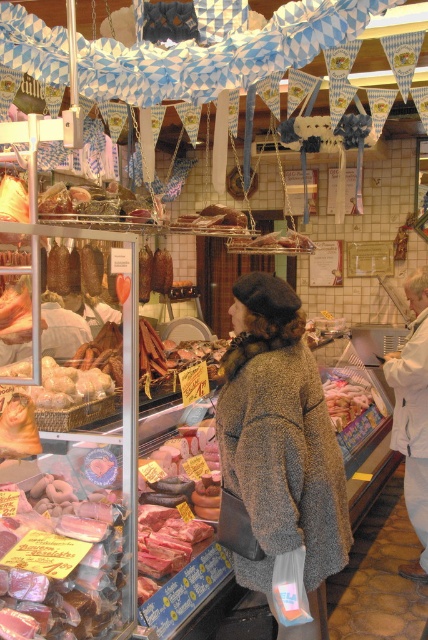
You are a customer in the butcher shop and want to know which item is taller between the pink glossy meat at lower left and the smooth pink sausage at center. Can you tell me?

The pink glossy meat at lower left is taller than the smooth pink sausage at center.

You are a customer in the butcher shop and want to know if your fuzzy brown coat at center will fit in the same shopping bag as the pink glossy meat at lower left. The bag can only hold items where the larger item is no more than twice the size of the smaller one. Can both items fit together?

The fuzzy brown coat at center is bigger than the pink glossy meat at lower left. Since the bag requires the larger item to be no more than twice the size of the smaller one, we need to know the exact size ratio. However, the description only states that the coat is bigger, not the exact size difference. Without knowing if it is exactly twice or more, we cannot confirm if they will fit together.

You are a customer in the butcher shop and want to buy both the pink glossy meat at lower left and the smooth pink sausage at center. If you want to pick them up in order from left to right, which one should you grab first?

The pink glossy meat at lower left should be grabbed first since it is positioned on the left side of the smooth pink sausage at center.